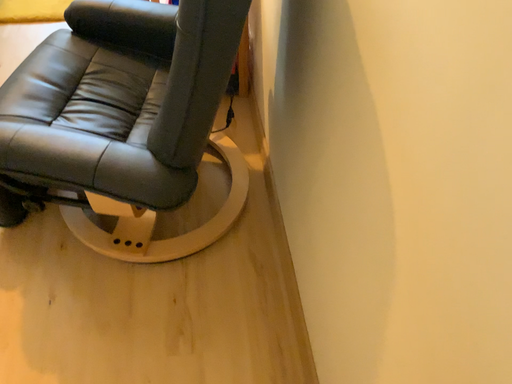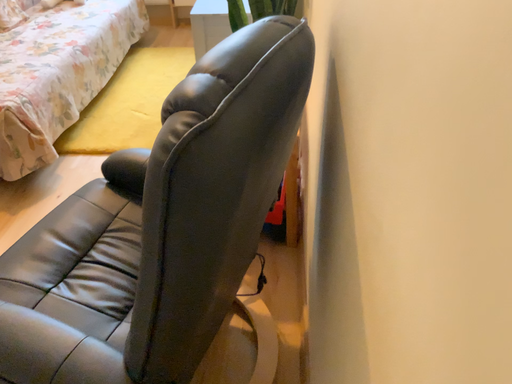
Question: Which way did the camera rotate in the video?

Choices:
 (A) rotated downward
 (B) rotated upward

Answer: (B)